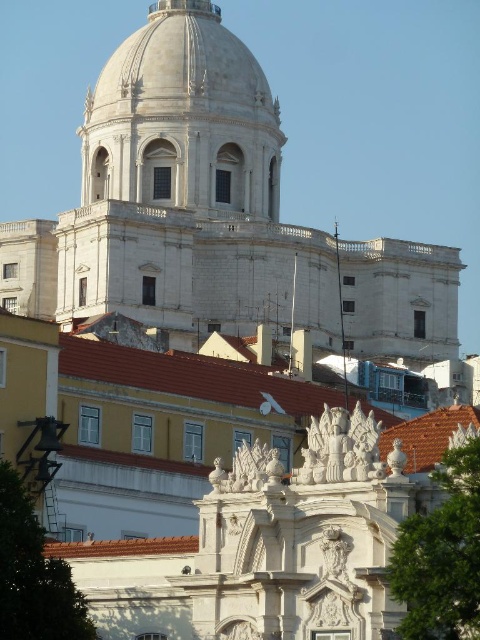
Between white marble dome at upper center and green leafy tree at center, which one has less height?

green leafy tree at center is shorter.

Can you confirm if white marble dome at upper center is smaller than green leafy tree at center?

Incorrect, white marble dome at upper center is not smaller in size than green leafy tree at center.

Where is `white marble dome at upper center`? This screenshot has width=480, height=640. white marble dome at upper center is located at coordinates (182, 118).

Between white marble dome at upper center and green leafy tree at lower left, which one is positioned lower?

Positioned lower is green leafy tree at lower left.

Can you confirm if white marble dome at upper center is positioned to the right of green leafy tree at lower left?

In fact, white marble dome at upper center is to the left of green leafy tree at lower left.

Between point (217, 77) and point (20, 588), which one is positioned behind?

Point (217, 77)

The width and height of the screenshot is (480, 640). I want to click on white marble dome at upper center, so click(x=182, y=118).

From the picture: Which is above, green leafy tree at center or green leafy tree at lower left?

green leafy tree at center

Does green leafy tree at center appear on the right side of green leafy tree at lower left?

Yes, green leafy tree at center is to the right of green leafy tree at lower left.

You are a GUI agent. You are given a task and a screenshot of the screen. Output one action in this format:
    pyautogui.click(x=<x>, y=<y>)
    Task: Click on the green leafy tree at center
    The image size is (480, 640).
    Given the screenshot: What is the action you would take?
    pyautogui.click(x=442, y=554)

This screenshot has height=640, width=480. Identify the location of green leafy tree at center. (442, 554).